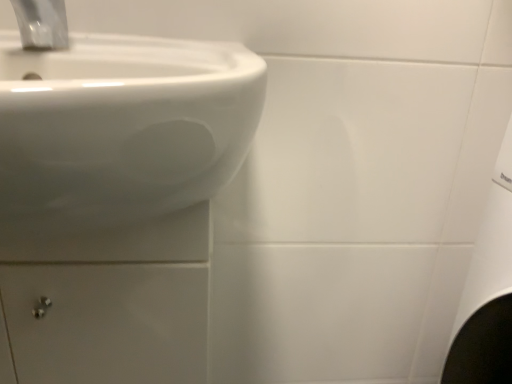
Question: Considering the positions of white glossy drawer at lower left and satin chrome faucet at upper left in the image, is white glossy drawer at lower left bigger or smaller than satin chrome faucet at upper left?

Choices:
 (A) small
 (B) big

Answer: (B)

Question: In the image, is white glossy drawer at lower left on the left side or the right side of satin chrome faucet at upper left?

Choices:
 (A) right
 (B) left

Answer: (B)

Question: From a real-world perspective, is white glossy drawer at lower left above or below satin chrome faucet at upper left?

Choices:
 (A) below
 (B) above

Answer: (A)

Question: Considering the positions of point (62, 8) and point (72, 281), is point (62, 8) closer or farther from the camera than point (72, 281)?

Choices:
 (A) farther
 (B) closer

Answer: (A)

Question: Is satin chrome faucet at upper left wider or thinner than white glossy drawer at lower left?

Choices:
 (A) wide
 (B) thin

Answer: (B)

Question: In terms of height, does satin chrome faucet at upper left look taller or shorter compared to white glossy drawer at lower left?

Choices:
 (A) tall
 (B) short

Answer: (B)

Question: Looking at the image, does satin chrome faucet at upper left seem bigger or smaller compared to white glossy drawer at lower left?

Choices:
 (A) big
 (B) small

Answer: (B)